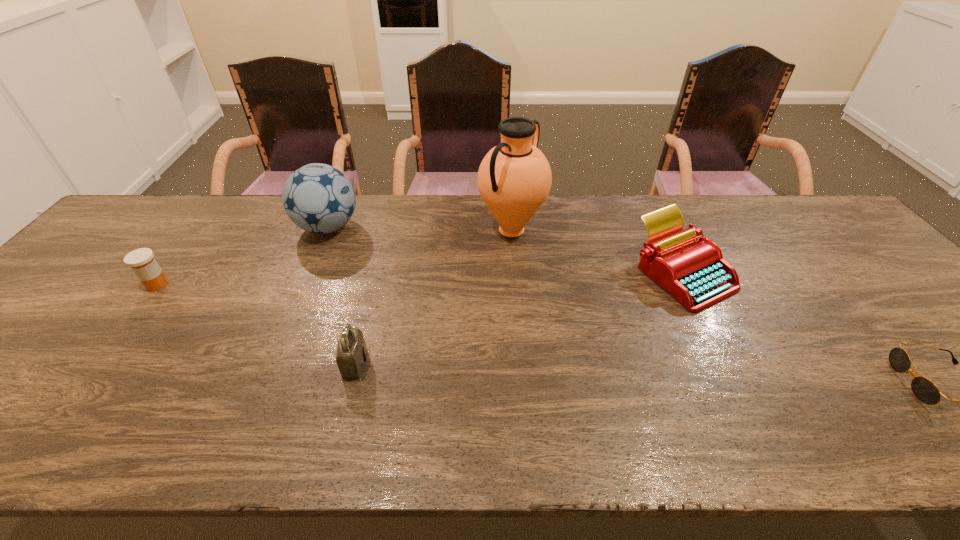
Where is `pitcher`? The image size is (960, 540). pitcher is located at coordinates (514, 178).

The height and width of the screenshot is (540, 960). Identify the location of the tallest object. (514, 178).

Find the location of a particular element. soccer ball is located at coordinates (318, 198).

Identify the location of the fifth shortest object. The height and width of the screenshot is (540, 960). (318, 198).

Locate an element on the screen. This screenshot has height=540, width=960. typewriter is located at coordinates (694, 273).

Where is `padlock`? The image size is (960, 540). padlock is located at coordinates (351, 358).

Where is `medicine`? Image resolution: width=960 pixels, height=540 pixels. medicine is located at coordinates (142, 262).

The width and height of the screenshot is (960, 540). Identify the location of the leftmost object. (142, 262).

Find the location of `vacant space located 0.120m on the front of the tallest object`. vacant space located 0.120m on the front of the tallest object is located at coordinates (516, 281).

Locate an element on the screen. This screenshot has width=960, height=540. blank space located 0.210m on the side with brand of the soccer ball is located at coordinates (429, 227).